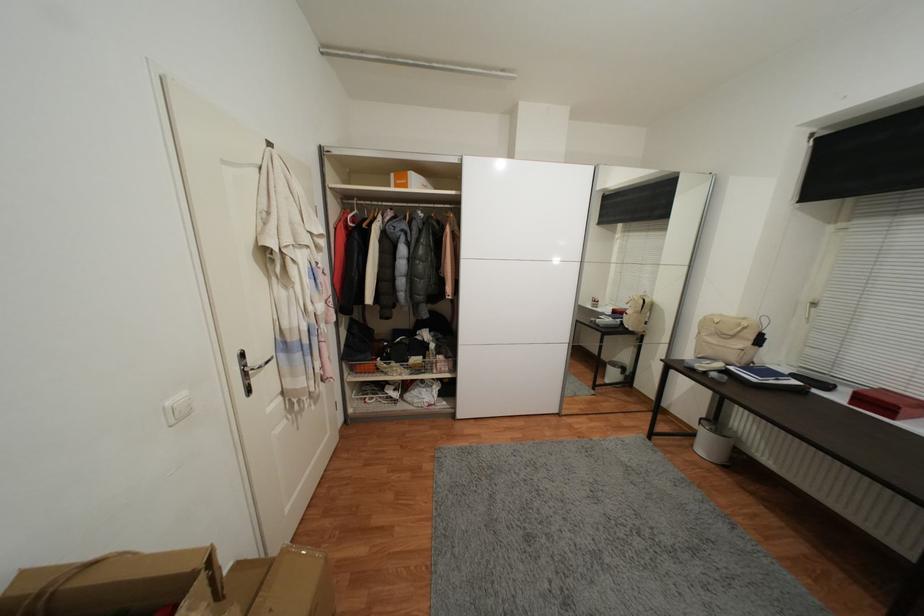
The image size is (924, 616). Describe the element at coordinates (813, 382) in the screenshot. I see `a black remote control` at that location.